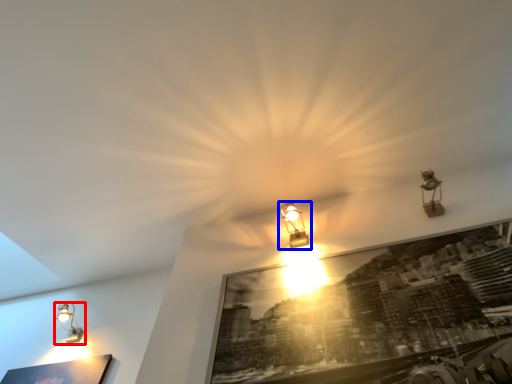
Question: Which point is closer to the camera, lamp (highlighted by a red box) or lamp (highlighted by a blue box)?

Choices:
 (A) lamp
 (B) lamp

Answer: (B)